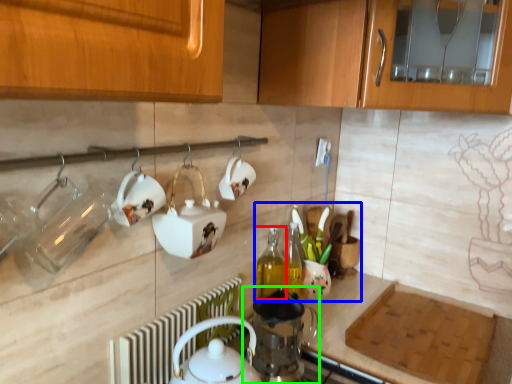
Question: Which object is positioned closest to bottle (highlighted by a red box)? Select from tea set (highlighted by a blue box) and appliance (highlighted by a green box).

Choices:
 (A) tea set
 (B) appliance

Answer: (A)